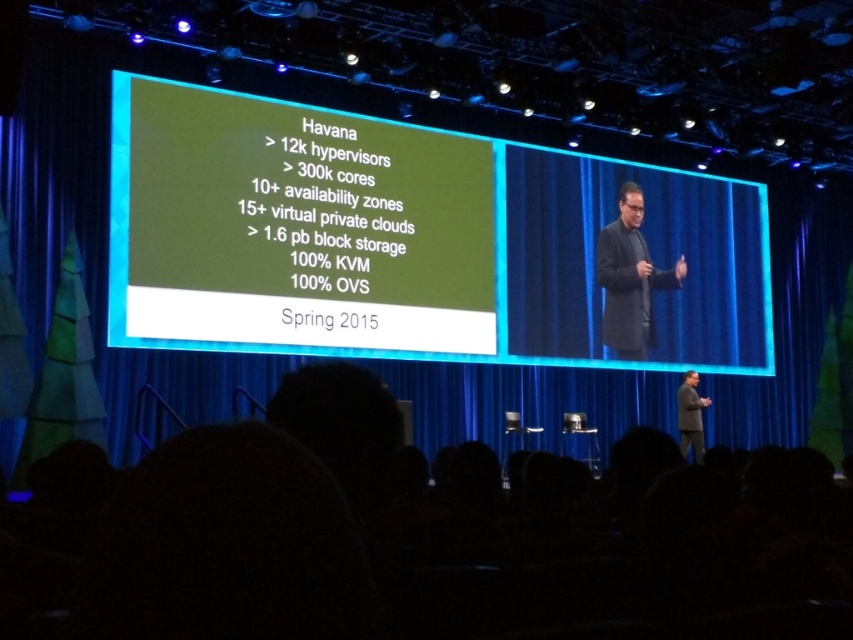
Question: Estimate the real-world distances between objects in this image. Which object is closer to the green matte text at upper center?

Choices:
 (A) dark gray suit at center
 (B) dark gray coat at center

Answer: (B)

Question: Does green matte text at upper center appear over dark gray suit at center?

Choices:
 (A) yes
 (B) no

Answer: (A)

Question: Considering the real-world distances, which object is farthest from the green matte text at upper center?

Choices:
 (A) dark gray coat at center
 (B) dark gray suit at center

Answer: (B)

Question: Is green matte text at upper center bigger than dark gray suit at center?

Choices:
 (A) no
 (B) yes

Answer: (B)

Question: Can you confirm if dark gray coat at center is smaller than dark gray suit at center?

Choices:
 (A) yes
 (B) no

Answer: (B)

Question: Which of the following is the closest to the observer?

Choices:
 (A) (614, 275)
 (B) (682, 404)

Answer: (A)